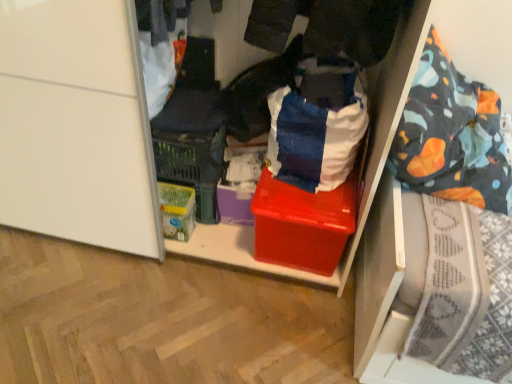
Describe the element at coordinates (303, 224) in the screenshot. The height and width of the screenshot is (384, 512). I see `shiny plastic box at center` at that location.

The image size is (512, 384). In order to click on blue cotton shirt at center, positioned as the 2th clothing in left-to-right order in this screenshot , I will do `click(258, 92)`.

This screenshot has width=512, height=384. Find the location of `white cotton shirt at upper left, arranged as the second clothing when viewed from the right`. white cotton shirt at upper left, arranged as the second clothing when viewed from the right is located at coordinates 161,47.

The height and width of the screenshot is (384, 512). What do you see at coordinates (161, 47) in the screenshot? I see `white cotton shirt at upper left, the first clothing positioned from the left` at bounding box center [161, 47].

Find the location of a particular element. The height and width of the screenshot is (384, 512). shiny plastic box at center is located at coordinates (303, 224).

Consider the image. Which of these two, white cotton shirt at upper left, arranged as the second clothing when viewed from the right, or shiny plastic box at center, is smaller?

With smaller size is white cotton shirt at upper left, arranged as the second clothing when viewed from the right.

Which object is closer to the camera, white cotton shirt at upper left, arranged as the second clothing when viewed from the right, or shiny plastic box at center?

white cotton shirt at upper left, arranged as the second clothing when viewed from the right, is closer to the camera.

Where is `box to the right of white cotton shirt at upper left, arranged as the second clothing when viewed from the right`? The width and height of the screenshot is (512, 384). box to the right of white cotton shirt at upper left, arranged as the second clothing when viewed from the right is located at coordinates (303, 224).

Can you confirm if white cotton shirt at upper left, arranged as the second clothing when viewed from the right, is thinner than shiny plastic box at center?

Yes, white cotton shirt at upper left, arranged as the second clothing when viewed from the right, is thinner than shiny plastic box at center.

What are the coordinates of `box positioned vertically above the green cardboard box at lower left (from a real-world perspective)` in the screenshot? It's located at (303, 224).

Looking at this image, from a real-world perspective, between shiny plastic box at center and green cardboard box at lower left, who is vertically lower?

From a 3D spatial view, green cardboard box at lower left is below.

Which point is more forward, [293,242] or [170,208]?

Positioned in front is point [293,242].

How different are the orientations of shiny plastic box at center and green cardboard box at lower left in degrees?

0.000412 degrees.

Considering the relative sizes of shiny plastic box at center and blue cotton shirt at center, which appears as the first clothing when viewed from the right, in the image provided, is shiny plastic box at center taller than blue cotton shirt at center, which appears as the first clothing when viewed from the right,?

No, shiny plastic box at center is not taller than blue cotton shirt at center, which appears as the first clothing when viewed from the right.

Considering the positions of objects shiny plastic box at center and blue cotton shirt at center, which appears as the first clothing when viewed from the right, in the image provided, who is in front, shiny plastic box at center or blue cotton shirt at center, which appears as the first clothing when viewed from the right,?

blue cotton shirt at center, which appears as the first clothing when viewed from the right, is more forward.

Is blue cotton shirt at center, which appears as the first clothing when viewed from the right, at the back of shiny plastic box at center?

shiny plastic box at center is not turned away from blue cotton shirt at center, which appears as the first clothing when viewed from the right.

From a real-world perspective, which clothing is the 1st one above the shiny plastic box at center? Please provide its 2D coordinates.

[(258, 92)]

Which object is more forward, blue cotton shirt at center, which appears as the first clothing when viewed from the right, or white cotton shirt at upper left, arranged as the second clothing when viewed from the right?

white cotton shirt at upper left, arranged as the second clothing when viewed from the right.

Is blue cotton shirt at center, positioned as the 2th clothing in left-to-right order, looking in the opposite direction of white cotton shirt at upper left, arranged as the second clothing when viewed from the right?

No, blue cotton shirt at center, positioned as the 2th clothing in left-to-right order, is not facing away from white cotton shirt at upper left, arranged as the second clothing when viewed from the right.

Which of these two, blue cotton shirt at center, positioned as the 2th clothing in left-to-right order, or white cotton shirt at upper left, arranged as the second clothing when viewed from the right, is thinner?

blue cotton shirt at center, positioned as the 2th clothing in left-to-right order.

Is white cotton shirt at upper left, the first clothing positioned from the left, next to green cardboard box at lower left?

They are not placed beside each other.

Which of these two, white cotton shirt at upper left, arranged as the second clothing when viewed from the right, or green cardboard box at lower left, is wider?

Wider between the two is white cotton shirt at upper left, arranged as the second clothing when viewed from the right.

Is white cotton shirt at upper left, arranged as the second clothing when viewed from the right, bigger or smaller than green cardboard box at lower left?

In the image, white cotton shirt at upper left, arranged as the second clothing when viewed from the right, appears to be larger than green cardboard box at lower left.

Which is more to the left, green cardboard box at lower left or shiny plastic box at center?

From the viewer's perspective, green cardboard box at lower left appears more on the left side.

Can you confirm if green cardboard box at lower left is bigger than shiny plastic box at center?

No.

Can you confirm if green cardboard box at lower left is shorter than shiny plastic box at center?

Correct, green cardboard box at lower left is not as tall as shiny plastic box at center.

From the image's perspective, is green cardboard box at lower left positioned above or below shiny plastic box at center?

Based on their image positions, green cardboard box at lower left is located beneath shiny plastic box at center.

Do you think shiny plastic box at center is within white cotton shirt at upper left, arranged as the second clothing when viewed from the right, or outside of it?

shiny plastic box at center is located beyond the bounds of white cotton shirt at upper left, arranged as the second clothing when viewed from the right.

From the image's perspective, which one is positioned lower, shiny plastic box at center or white cotton shirt at upper left, arranged as the second clothing when viewed from the right?

From the image's view, shiny plastic box at center is below.

The image size is (512, 384). Identify the location of box on the right of white cotton shirt at upper left, the first clothing positioned from the left. (303, 224).

This screenshot has height=384, width=512. What are the coordinates of `storage box on the left of shiny plastic box at center` in the screenshot? It's located at (177, 210).

Based on their spatial positions, is green cardboard box at lower left or shiny plastic box at center closer to blue cotton shirt at center, positioned as the 2th clothing in left-to-right order?

shiny plastic box at center.

Based on their spatial positions, is blue cotton shirt at center, positioned as the 2th clothing in left-to-right order, or white cotton shirt at upper left, arranged as the second clothing when viewed from the right, further from shiny plastic box at center?

white cotton shirt at upper left, arranged as the second clothing when viewed from the right, lies further to shiny plastic box at center than the other object.

Based on their spatial positions, is blue cotton shirt at center, which appears as the first clothing when viewed from the right, or green cardboard box at lower left closer to shiny plastic box at center?

blue cotton shirt at center, which appears as the first clothing when viewed from the right.

Based on their spatial positions, is white cotton shirt at upper left, the first clothing positioned from the left, or blue cotton shirt at center, which appears as the first clothing when viewed from the right, closer to shiny plastic box at center?

blue cotton shirt at center, which appears as the first clothing when viewed from the right, is closer to shiny plastic box at center.

Based on the photo, estimate the real-world distances between objects in this image. Which object is further from green cardboard box at lower left, white cotton shirt at upper left, arranged as the second clothing when viewed from the right, or shiny plastic box at center?

white cotton shirt at upper left, arranged as the second clothing when viewed from the right.

From the picture: Based on their spatial positions, is shiny plastic box at center or blue cotton shirt at center, which appears as the first clothing when viewed from the right, further from white cotton shirt at upper left, arranged as the second clothing when viewed from the right?

shiny plastic box at center is further to white cotton shirt at upper left, arranged as the second clothing when viewed from the right.

Estimate the real-world distances between objects in this image. Which object is further from green cardboard box at lower left, blue cotton shirt at center, which appears as the first clothing when viewed from the right, or white cotton shirt at upper left, arranged as the second clothing when viewed from the right?

The object further to green cardboard box at lower left is white cotton shirt at upper left, arranged as the second clothing when viewed from the right.

From the image, which object appears to be nearer to white cotton shirt at upper left, the first clothing positioned from the left, blue cotton shirt at center, which appears as the first clothing when viewed from the right, or shiny plastic box at center?

blue cotton shirt at center, which appears as the first clothing when viewed from the right.

The height and width of the screenshot is (384, 512). Find the location of `clothing between white cotton shirt at upper left, arranged as the second clothing when viewed from the right, and green cardboard box at lower left in the up-down direction`. clothing between white cotton shirt at upper left, arranged as the second clothing when viewed from the right, and green cardboard box at lower left in the up-down direction is located at coordinates click(258, 92).

Identify the location of clothing between white cotton shirt at upper left, the first clothing positioned from the left, and shiny plastic box at center from left to right. The width and height of the screenshot is (512, 384). (258, 92).